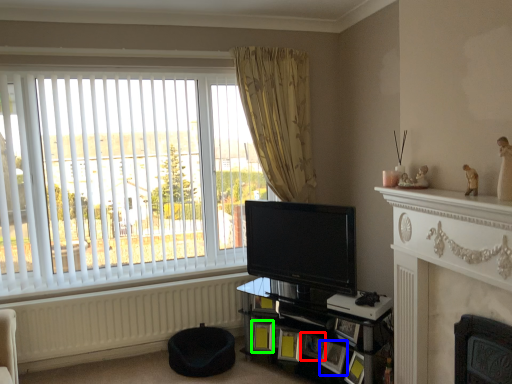
Question: Based on their relative distances, which object is nearer to picture frame (highlighted by a red box)? Choose from picture frame (highlighted by a blue box) and picture frame (highlighted by a green box).

Choices:
 (A) picture frame
 (B) picture frame

Answer: (A)